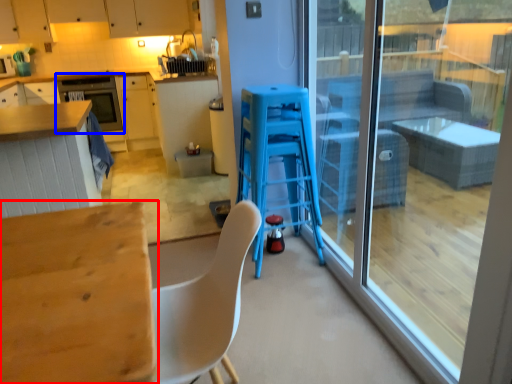
Question: Which point is closer to the camera, table (highlighted by a red box) or oven (highlighted by a blue box)?

Choices:
 (A) table
 (B) oven

Answer: (A)